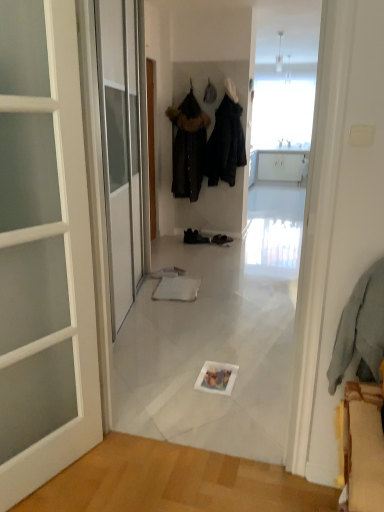
Question: Is black fabric coat at center, which is counted as the second clothing, starting from the back, beside dark brown fur-trimmed coat at center, positioned as the third clothing in front-to-back order?

Choices:
 (A) no
 (B) yes

Answer: (A)

Question: Can you confirm if black fabric coat at center, which is counted as the second clothing, starting from the back, is positioned to the right of dark brown fur-trimmed coat at center, positioned as the third clothing in front-to-back order?

Choices:
 (A) no
 (B) yes

Answer: (B)

Question: Considering the relative sizes of black fabric coat at center, arranged as the second clothing when viewed from the front, and dark brown fur-trimmed coat at center, the 1th clothing positioned from the back, in the image provided, is black fabric coat at center, arranged as the second clothing when viewed from the front, thinner than dark brown fur-trimmed coat at center, the 1th clothing positioned from the back,?

Choices:
 (A) no
 (B) yes

Answer: (A)

Question: Does black fabric coat at center, which is counted as the second clothing, starting from the back, have a greater height compared to dark brown fur-trimmed coat at center, the 1th clothing positioned from the back?

Choices:
 (A) yes
 (B) no

Answer: (B)

Question: From the image's perspective, does black fabric coat at center, arranged as the second clothing when viewed from the front, appear lower than dark brown fur-trimmed coat at center, the 1th clothing positioned from the back?

Choices:
 (A) no
 (B) yes

Answer: (A)

Question: From a real-world perspective, relative to dark brown fur-trimmed coat at center, positioned as the third clothing in front-to-back order, is light blue fabric at right, acting as the 1th clothing starting from the front, vertically above or below?

Choices:
 (A) below
 (B) above

Answer: (A)

Question: In the image, is light blue fabric at right, acting as the 1th clothing starting from the front, positioned in front of or behind dark brown fur-trimmed coat at center, the 1th clothing positioned from the back?

Choices:
 (A) behind
 (B) front

Answer: (B)

Question: In the image, is light blue fabric at right, which appears as the 3th clothing when viewed from the back, on the left side or the right side of dark brown fur-trimmed coat at center, positioned as the third clothing in front-to-back order?

Choices:
 (A) right
 (B) left

Answer: (A)

Question: Considering the positions of light blue fabric at right, which appears as the 3th clothing when viewed from the back, and dark brown fur-trimmed coat at center, the 1th clothing positioned from the back, in the image, is light blue fabric at right, which appears as the 3th clothing when viewed from the back, wider or thinner than dark brown fur-trimmed coat at center, the 1th clothing positioned from the back,?

Choices:
 (A) thin
 (B) wide

Answer: (A)

Question: In the image, is black fabric coat at center, arranged as the second clothing when viewed from the front, on the left side or the right side of black leather shoes at center, the second footwear when ordered from right to left?

Choices:
 (A) left
 (B) right

Answer: (B)

Question: In terms of width, does black fabric coat at center, arranged as the second clothing when viewed from the front, look wider or thinner when compared to black leather shoes at center, the second footwear when ordered from right to left?

Choices:
 (A) thin
 (B) wide

Answer: (B)

Question: From a real-world perspective, is black fabric coat at center, arranged as the second clothing when viewed from the front, above or below black leather shoes at center, which is the first footwear from left to right?

Choices:
 (A) above
 (B) below

Answer: (A)

Question: Considering the positions of point (233, 120) and point (206, 238), is point (233, 120) closer or farther from the camera than point (206, 238)?

Choices:
 (A) farther
 (B) closer

Answer: (B)

Question: Considering the positions of black leather shoes at center, which is the first footwear from left to right, and light blue fabric at right, acting as the 1th clothing starting from the front, in the image, is black leather shoes at center, which is the first footwear from left to right, taller or shorter than light blue fabric at right, acting as the 1th clothing starting from the front,?

Choices:
 (A) short
 (B) tall

Answer: (A)

Question: In terms of width, does black leather shoes at center, which is the first footwear from left to right, look wider or thinner when compared to light blue fabric at right, acting as the 1th clothing starting from the front?

Choices:
 (A) wide
 (B) thin

Answer: (A)